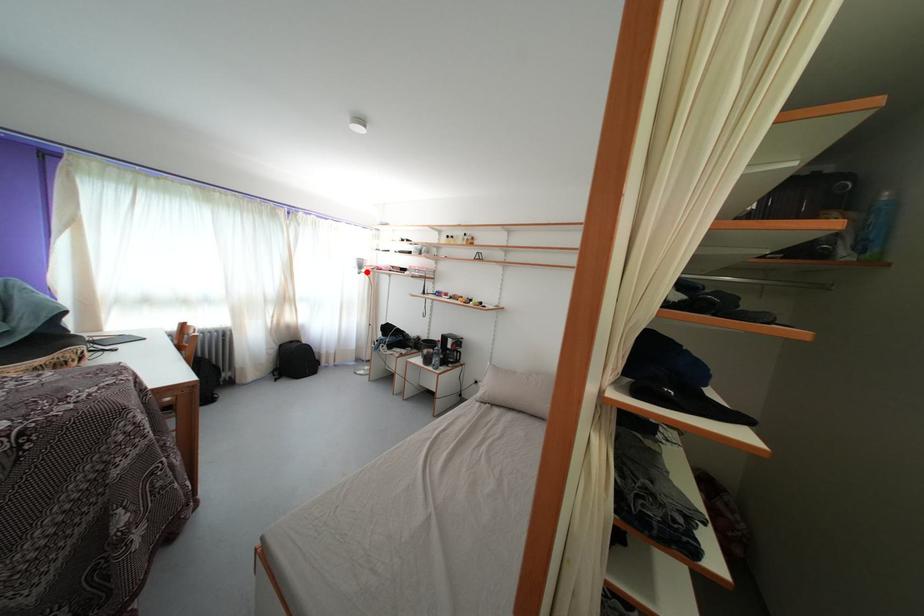
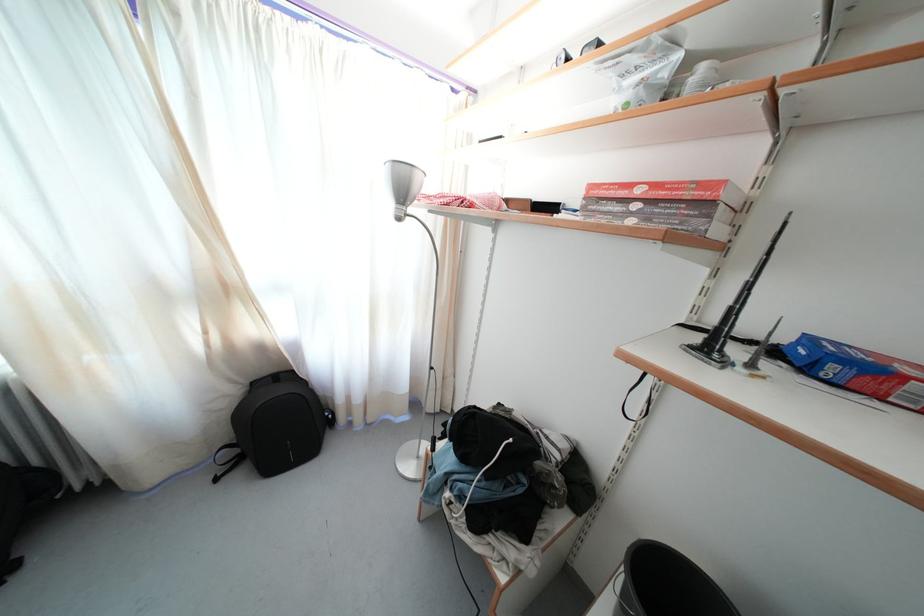
Locate, in the second image, the point that corresponds to the highlighted location in the first image.

(408, 199)